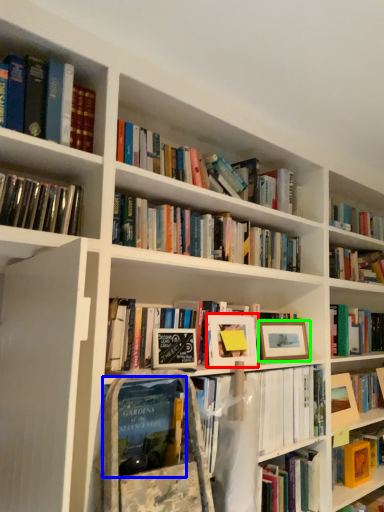
Question: Estimate the real-world distances between objects in this image. Which object is farther from picture frame (highlighted by a red box), book (highlighted by a blue box) or picture frame (highlighted by a green box)?

Choices:
 (A) book
 (B) picture frame

Answer: (A)